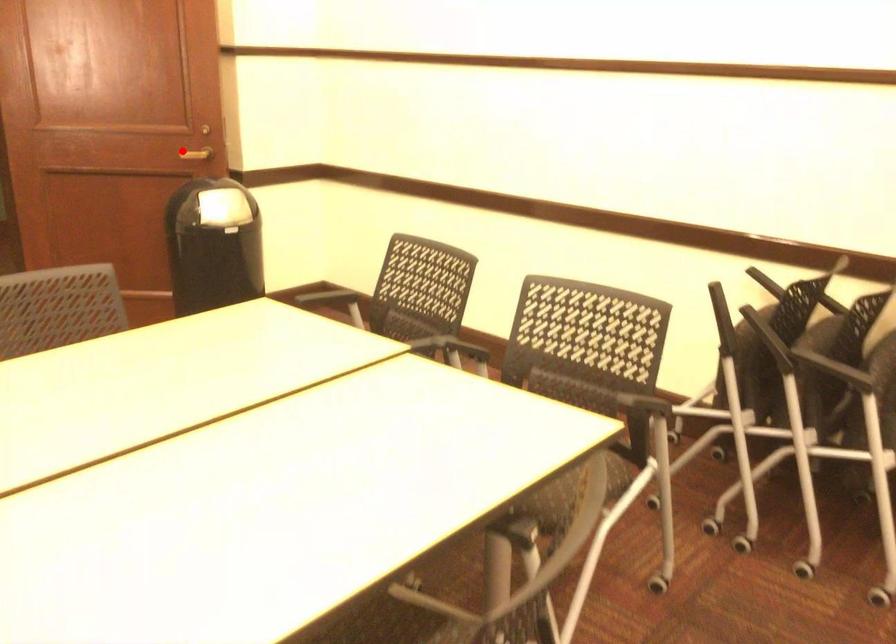
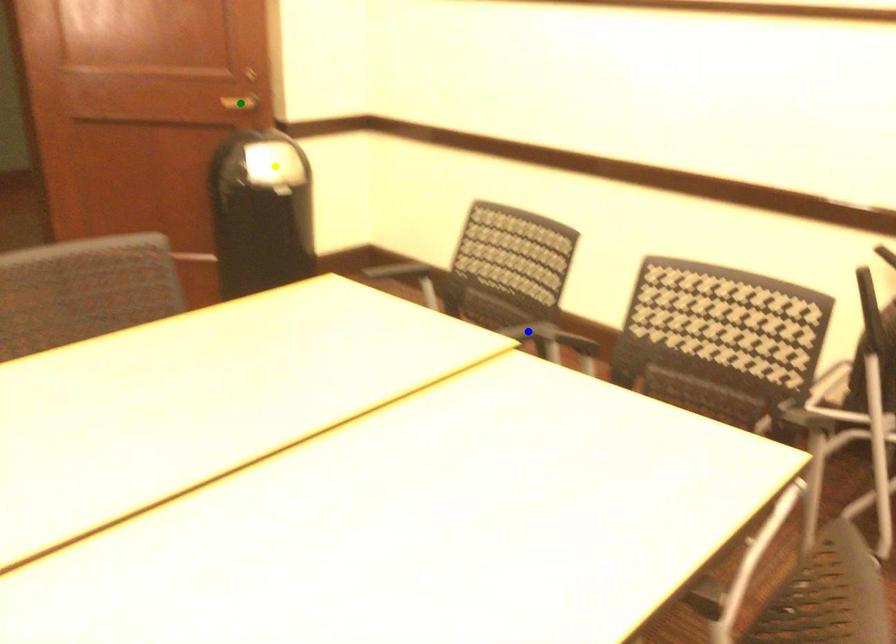
Question: I am providing you with two images of the same scene from different viewpoints. A red point is marked on the first image. You are given multiple points on the second image. Which point in image 2 represents the same 3d spot as the red point in image 1?

Choices:
 (A) yellow point
 (B) green point
 (C) blue point

Answer: (B)